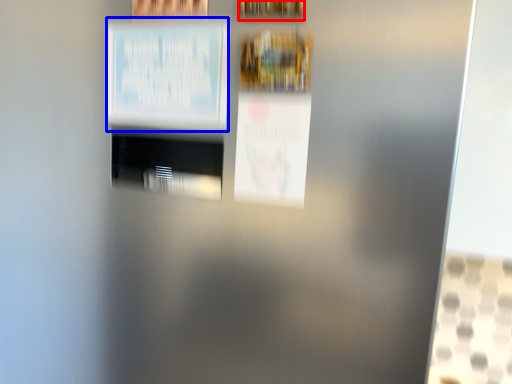
Question: Which object appears farthest to the camera in this image, picture frame (highlighted by a red box) or poster (highlighted by a blue box)?

Choices:
 (A) picture frame
 (B) poster

Answer: (B)